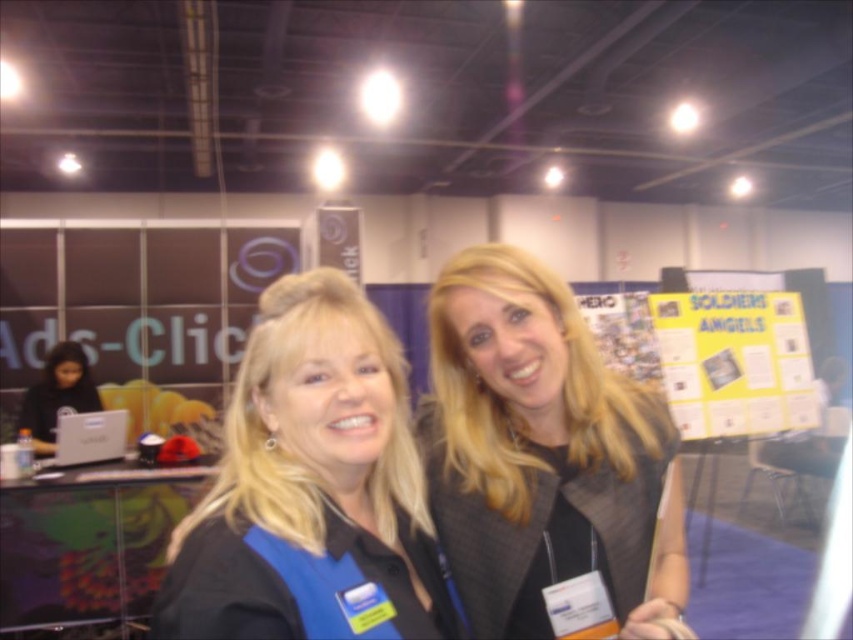
Does blue fabric shirt at center come in front of black matte laptop at left?

That is True.

Can you confirm if blue fabric shirt at center is wider than black matte laptop at left?

No.

Is point (253, 387) positioned before point (67, 403)?

Yes, it is in front of point (67, 403).

The height and width of the screenshot is (640, 853). What are the coordinates of `blue fabric shirt at center` in the screenshot? It's located at 312,486.

Between point (665, 556) and point (62, 378), which one is positioned in front?

Point (665, 556) is in front.

Measure the distance between point (666, 547) and camera.

The distance of point (666, 547) from camera is 98.31 centimeters.

Find the location of a particular element. The image size is (853, 640). gray textured blazer at center is located at coordinates (543, 452).

Is gray textured blazer at center taller than blue fabric shirt at center?

Yes.

Does gray textured blazer at center have a smaller size compared to blue fabric shirt at center?

Actually, gray textured blazer at center might be larger than blue fabric shirt at center.

The image size is (853, 640). I want to click on gray textured blazer at center, so click(543, 452).

Image resolution: width=853 pixels, height=640 pixels. Find the location of `gray textured blazer at center`. gray textured blazer at center is located at coordinates (543, 452).